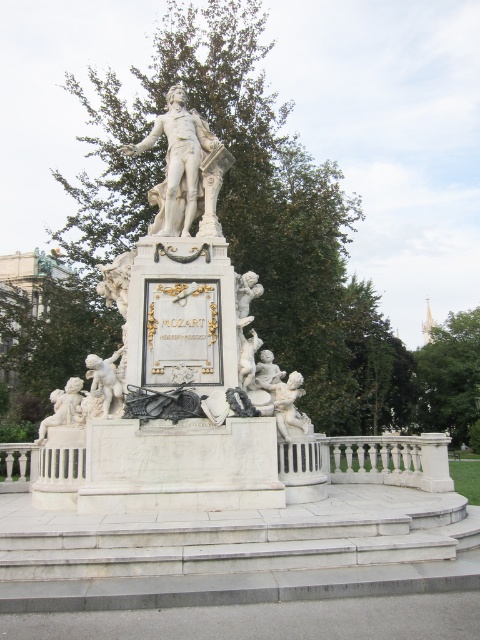
You are a tourist standing in front of the Mozart statue and want to take a photo of the white marble cherub at lower left and the matte white cherub at lower left. Which one is positioned lower in the image?

The white marble cherub at lower left is located below the matte white cherub at lower left, so it is positioned lower in the image.

You are standing in the public square facing the Mozart statue. You notice two points marked on the statue base. The first point is at coordinates point (355,452) and the second is at point (169,154). Which point is closer to you when facing the statue?

Point (169,154) is closer to you because it is in front of point (355,452) when facing the statue.

You are a tourist visiting the Mozart statue and want to take a photo. The white marble statue at center is in the background, and the white marble railing at center is in front of it. Will the railing block your view of the statue?

The white marble railing at center is shorter than the white marble statue at center, so the railing will not completely block your view of the statue as it is shorter in height.